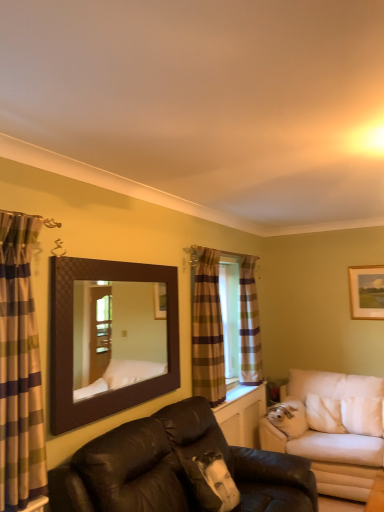
Question: Is brown textured mirror at upper center completely or partially outside of wooden framed picture at upper right?

Choices:
 (A) no
 (B) yes

Answer: (B)

Question: Is wooden framed picture at upper right inside brown textured mirror at upper center?

Choices:
 (A) yes
 (B) no

Answer: (B)

Question: Is brown textured mirror at upper center behind wooden framed picture at upper right?

Choices:
 (A) yes
 (B) no

Answer: (B)

Question: Would you consider brown textured mirror at upper center to be distant from wooden framed picture at upper right?

Choices:
 (A) yes
 (B) no

Answer: (A)

Question: Considering the relative sizes of brown textured mirror at upper center and wooden framed picture at upper right in the image provided, is brown textured mirror at upper center shorter than wooden framed picture at upper right?

Choices:
 (A) no
 (B) yes

Answer: (A)

Question: Is brown textured mirror at upper center at the right side of wooden framed picture at upper right?

Choices:
 (A) no
 (B) yes

Answer: (A)

Question: Does plaid fabric curtain at window, arranged as the 1th curtain when viewed from the back, have a greater height compared to white fabric studio couch at right, placed as the first studio couch when sorted from right to left?

Choices:
 (A) yes
 (B) no

Answer: (A)

Question: Does plaid fabric curtain at window, the third curtain in the front-to-back sequence, lie in front of white fabric studio couch at right, which ranks as the 2th studio couch in left-to-right order?

Choices:
 (A) no
 (B) yes

Answer: (A)

Question: Does plaid fabric curtain at window, the 1th curtain viewed from the right, have a smaller size compared to white fabric studio couch at right, which ranks as the first studio couch in back-to-front order?

Choices:
 (A) yes
 (B) no

Answer: (A)

Question: Can you confirm if plaid fabric curtain at window, the 1th curtain viewed from the right, is positioned to the right of white fabric studio couch at right, placed as the first studio couch when sorted from right to left?

Choices:
 (A) no
 (B) yes

Answer: (A)

Question: Is white fabric studio couch at right, which ranks as the first studio couch in back-to-front order, at the back of plaid fabric curtain at window, the 1th curtain viewed from the right?

Choices:
 (A) yes
 (B) no

Answer: (B)

Question: Is there a large distance between plaid fabric curtain at window, the third curtain in the front-to-back sequence, and white fabric studio couch at right, acting as the 2th studio couch starting from the front?

Choices:
 (A) yes
 (B) no

Answer: (B)

Question: Can we say brown textured mirror at upper center lies outside plaid fabric curtain at center, which is counted as the second curtain, starting from the front?

Choices:
 (A) yes
 (B) no

Answer: (A)